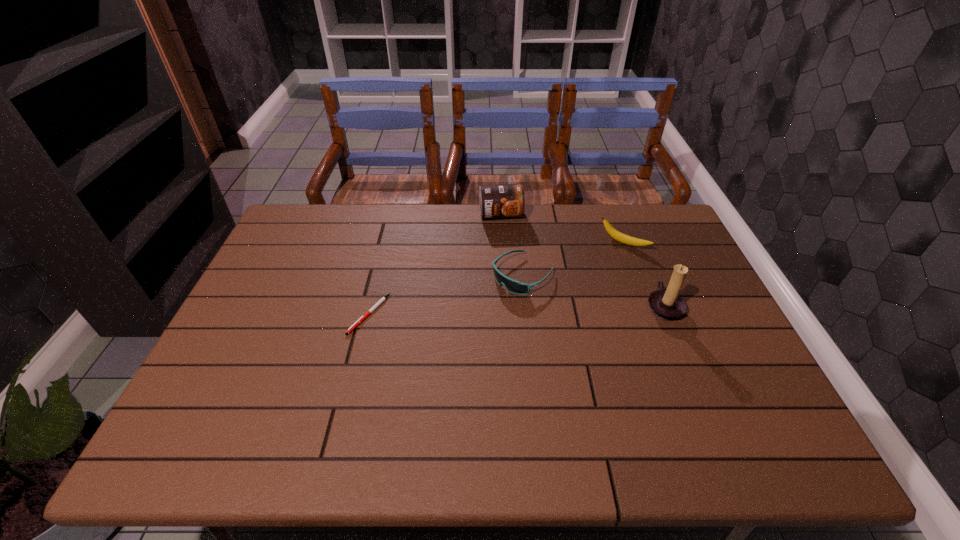
Where is `candle holder that is at the right edge`? candle holder that is at the right edge is located at coordinates (668, 305).

The width and height of the screenshot is (960, 540). I want to click on banana that is positioned at the right edge, so click(616, 235).

Locate an element on the screen. This screenshot has height=540, width=960. object located at the far right corner is located at coordinates (616, 235).

You are a GUI agent. You are given a task and a screenshot of the screen. Output one action in this format:
    pyautogui.click(x=<x>, y=<y>)
    Task: Click on the free spot at the far edge of the desktop
    Image resolution: width=960 pixels, height=540 pixels.
    Given the screenshot: What is the action you would take?
    pyautogui.click(x=396, y=220)

In the image, there is a desktop. At what (x,y) coordinates should I click in order to perform the action: click on vacant space at the left edge. Please return your answer as a coordinate pair (x, y). Looking at the image, I should click on (252, 379).

Where is `free space at the right edge of the desktop`? free space at the right edge of the desktop is located at coordinates (705, 293).

This screenshot has height=540, width=960. I want to click on blank region between the candle holder and the second farthest object, so point(643,275).

Image resolution: width=960 pixels, height=540 pixels. What are the coordinates of `vacant space that's between the tallest object and the farthest object` in the screenshot? It's located at (582, 261).

I want to click on vacant space that's between the sunglasses and the second farthest object, so click(x=573, y=259).

You are a GUI agent. You are given a task and a screenshot of the screen. Output one action in this format:
    pyautogui.click(x=<x>, y=<y>)
    Task: Click on the unoccupied position between the sunglasses and the tallest object
    The width and height of the screenshot is (960, 540).
    Given the screenshot: What is the action you would take?
    pyautogui.click(x=593, y=291)